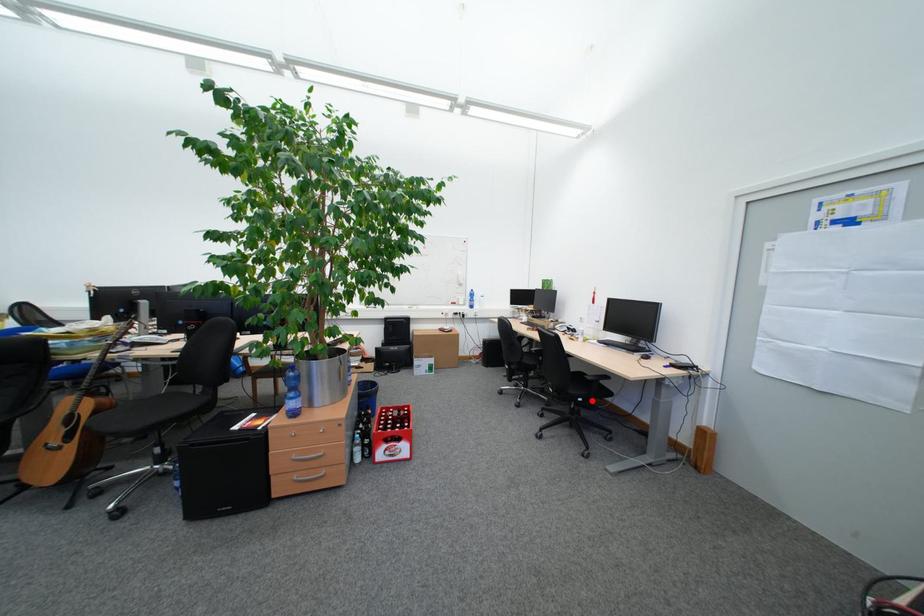
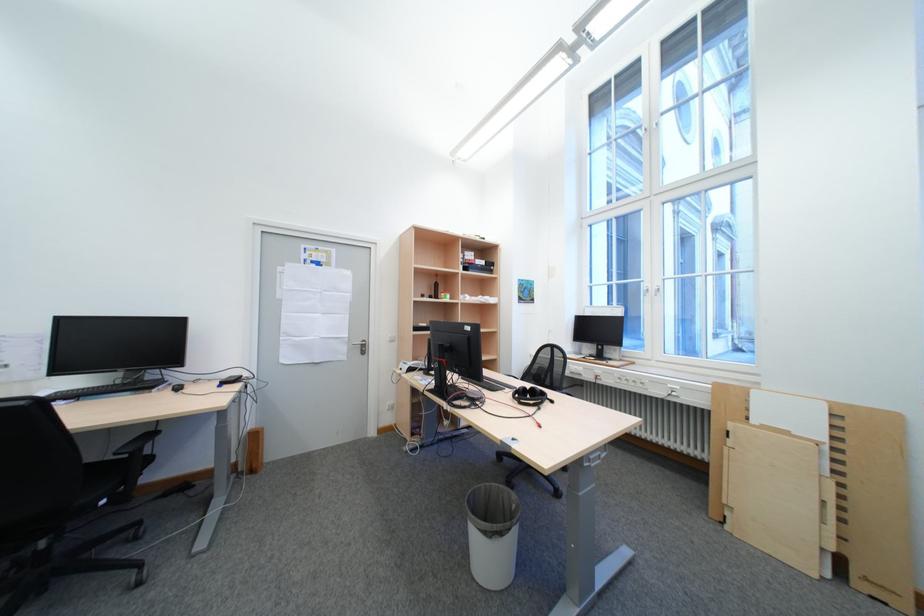
Question: I am providing you with two images of the same scene from different viewpoints. A red point is shown in image1. For the corresponding object point in image2, is it positioned nearer or farther from the camera?

Choices:
 (A) Nearer
 (B) Farther

Answer: (A)